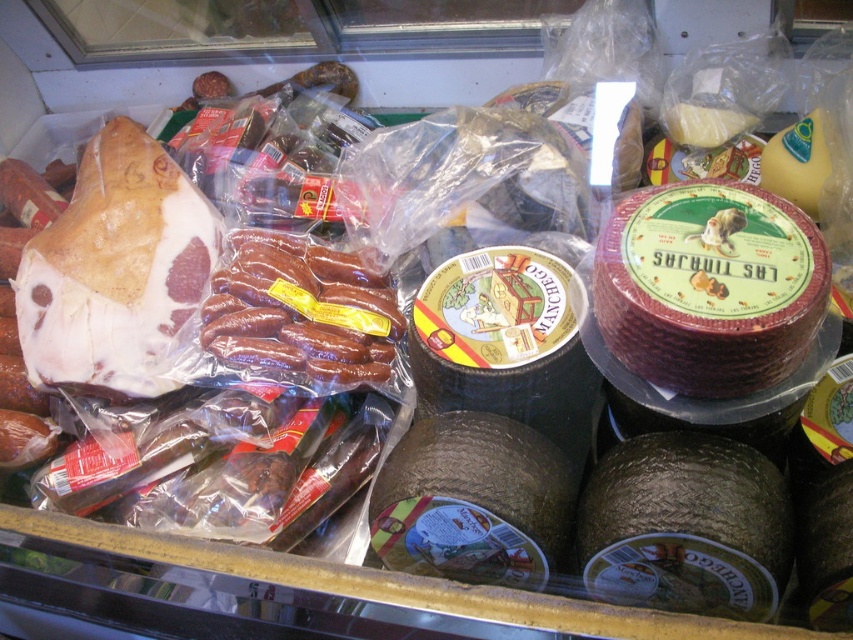
You are a store employee who needs to stack items from the display case onto a shelf. The shelf has limited height space. Which item, the red textured cheese at center right or the brown glossy sausages at center, should you place first to ensure they both fit on the shelf?

The red textured cheese at center right is thinner than the brown glossy sausages at center. To ensure both items fit on the shelf with limited height, place the thinner red textured cheese at center right first, then stack the thicker brown glossy sausages at center on top.

You are a customer trying to reach the cheese in the refrigerated section. The red textured cheese at center right and the brown glossy sausages at center are both on the same shelf. Which item is closer to you?

The red textured cheese at center right is shorter than the brown glossy sausages at center, so the brown glossy sausages at center are closer to you.

You are a customer in the store and want to pick up the red textured cheese at center right and the brown glossy sausages at center. Which item will you reach first if you approach the display case from the front?

The red textured cheese at center right will be reached first because it is in front of the brown glossy sausages at center, making it closer to you when approaching the display case from the front.